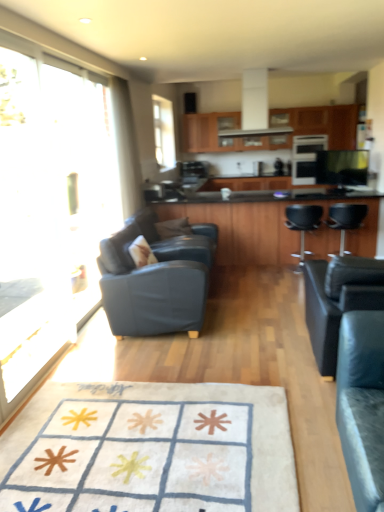
What do you see at coordinates (192, 170) in the screenshot? This screenshot has width=384, height=512. I see `black plastic coffee machine at center` at bounding box center [192, 170].

Where is `black leather chair at right, which is counted as the fourth chair, starting from the left`? black leather chair at right, which is counted as the fourth chair, starting from the left is located at coordinates (346, 219).

Describe the element at coordinates (302, 227) in the screenshot. I see `black leather bar stool at center right, which ranks as the 3th chair in left-to-right order` at that location.

What is the approximate width of black leather bar stool at center right, which ranks as the 3th chair in left-to-right order?

black leather bar stool at center right, which ranks as the 3th chair in left-to-right order, is 21.33 inches wide.

Where is `transparent glass window at upper center`? The image size is (384, 512). transparent glass window at upper center is located at coordinates (158, 132).

What do you see at coordinates (342, 167) in the screenshot? I see `black glossy tv at upper right, which is counted as the 1th appliance, starting from the front` at bounding box center [342, 167].

In order to face black glossy tv at upper right, the 2th appliance in the top-to-bottom sequence, should I rotate leftwards or rightwards?

To face it directly, rotate right by 18.909 degrees.

Find the location of `satin black microwave at center, which is the 1th appliance in top-to-bottom order`. satin black microwave at center, which is the 1th appliance in top-to-bottom order is located at coordinates (306, 157).

From a real-world perspective, is black laminate countertop at center located higher than black leather chair at right, the 1th chair viewed from the right?

Yes.

Where is `countertop on the left side of black leather chair at right, the 1th chair viewed from the right`? countertop on the left side of black leather chair at right, the 1th chair viewed from the right is located at coordinates (263, 225).

Is black laminate countertop at center positioned with its back to black leather chair at right, which is counted as the fourth chair, starting from the left?

black laminate countertop at center is not turned away from black leather chair at right, which is counted as the fourth chair, starting from the left.

Who is smaller, black laminate countertop at center or black leather chair at right, the 1th chair viewed from the right?

black leather chair at right, the 1th chair viewed from the right, is smaller.

This screenshot has width=384, height=512. In order to click on the 2nd appliance behind the white fabric doormat at center, counting from the anchor's position in this screenshot , I will do `click(306, 157)`.

Is satin black microwave at center, which is the 1th appliance from back to front, behind white fabric doormat at center?

Yes, it is.

How different are the orientations of satin black microwave at center, which is the 1th appliance in top-to-bottom order, and white fabric doormat at center in degrees?

The angle between the facing direction of satin black microwave at center, which is the 1th appliance in top-to-bottom order, and the facing direction of white fabric doormat at center is 0.133 degrees.

Is satin black microwave at center, which is the 1th appliance from back to front, taller than white fabric doormat at center?

Yes.

Is black leather bar stool at center right, which appears as the second chair when viewed from the right, shorter than black glossy tv at upper right, which is the 2th appliance from back to front?

No.

Is black leather bar stool at center right, which ranks as the 3th chair in left-to-right order, located outside black glossy tv at upper right, the 1th appliance ordered from the bottom?

Yes, black leather bar stool at center right, which ranks as the 3th chair in left-to-right order, is located beyond the bounds of black glossy tv at upper right, the 1th appliance ordered from the bottom.

From a real-world perspective, does black leather bar stool at center right, which appears as the second chair when viewed from the right, sit lower than black glossy tv at upper right, which is counted as the 1th appliance, starting from the front?

Yes, from a real-world perspective, black leather bar stool at center right, which appears as the second chair when viewed from the right, is beneath black glossy tv at upper right, which is counted as the 1th appliance, starting from the front.

Looking at this image, is black leather bar stool at center right, which ranks as the 3th chair in left-to-right order, positioned with its back to black glossy tv at upper right, the 2th appliance in the top-to-bottom sequence?

No.

How different are the orientations of black plastic coffee machine at center and satin black microwave at center, which is the second appliance from bottom to top, in degrees?

The facing directions of black plastic coffee machine at center and satin black microwave at center, which is the second appliance from bottom to top, are 10.4 degrees apart.

Looking at this image, which is further, (x=192, y=178) or (x=294, y=170)?

The point (x=294, y=170) is farther from the camera.

Visually, is black plastic coffee machine at center positioned to the left or to the right of satin black microwave at center, which is the 1th appliance from back to front?

Based on their positions, black plastic coffee machine at center is located to the left of satin black microwave at center, which is the 1th appliance from back to front.

In the scene shown: From a real-world perspective, who is located lower, black plastic coffee machine at center or satin black microwave at center, which is the second appliance from bottom to top?

From a 3D spatial view, black plastic coffee machine at center is below.

In the image, is black laminate countertop at center positioned in front of or behind black glossy tv at upper right, which is counted as the 1th appliance, starting from the front?

Visually, black laminate countertop at center is located in front of black glossy tv at upper right, which is counted as the 1th appliance, starting from the front.

Is black laminate countertop at center in contact with black glossy tv at upper right, which is counted as the 1th appliance, starting from the front?

black laminate countertop at center and black glossy tv at upper right, which is counted as the 1th appliance, starting from the front, are clearly separated.

Could you tell me if black laminate countertop at center is turned towards black glossy tv at upper right, which is counted as the 1th appliance, starting from the front?

No.

From the image's perspective, is black laminate countertop at center beneath black glossy tv at upper right, which is the 2th appliance from back to front?

Yes.

Is white fabric doormat at center bigger or smaller than transparent glass door at left?

In the image, white fabric doormat at center appears to be smaller than transparent glass door at left.

Is white fabric doormat at center far away from transparent glass door at left?

Absolutely, white fabric doormat at center is distant from transparent glass door at left.

Is white fabric doormat at center turned away from transparent glass door at left?

No, white fabric doormat at center is not facing the opposite direction of transparent glass door at left.

Based on the photo, can you confirm if white fabric doormat at center is taller than transparent glass door at left?

No.

Is white glossy exhaust hood at upper center facing towards white fabric doormat at center?

No, white glossy exhaust hood at upper center is not aimed at white fabric doormat at center.

Is point (242, 108) more distant than point (219, 459)?

Yes, point (242, 108) is farther from viewer.

Considering the relative positions of white glossy exhaust hood at upper center and white fabric doormat at center in the image provided, is white glossy exhaust hood at upper center to the right of white fabric doormat at center from the viewer's perspective?

Correct, you'll find white glossy exhaust hood at upper center to the right of white fabric doormat at center.

Locate an element on the screen. This screenshot has height=512, width=384. countertop on the left of black leather chair at right, the 1th chair viewed from the right is located at coordinates (263, 225).

This screenshot has width=384, height=512. Identify the location of doormat below the satin black microwave at center, which is the 1th appliance in top-to-bottom order (from the image's perspective). (150, 449).

When comparing their distances from black plastic coffee machine at center, does transparent glass door at left or black leather bar stool at center right, which ranks as the 3th chair in left-to-right order, seem closer?

black leather bar stool at center right, which ranks as the 3th chair in left-to-right order, lies closer to black plastic coffee machine at center than the other object.

From the image, which object appears to be farther from satin black microwave at center, which is the 1th appliance in top-to-bottom order, black leather chair at right, the 1th chair viewed from the right, or black leather bar stool at center right, which appears as the second chair when viewed from the right?

black leather chair at right, the 1th chair viewed from the right.

Looking at the image, which one is located closer to white fabric doormat at center, satin black microwave at center, placed as the second appliance when sorted from front to back, or black leather chair at right, positioned as the 3th chair in right-to-left order?

The object closer to white fabric doormat at center is black leather chair at right, positioned as the 3th chair in right-to-left order.

When comparing their distances from black plastic coffee machine at center, does matte blue leather chair at left, which is the fourth chair in right-to-left order, or transparent glass door at left seem closer?

matte blue leather chair at left, which is the fourth chair in right-to-left order, is positioned closer to the anchor black plastic coffee machine at center.

When comparing their distances from black leather chair at right, the 1th chair viewed from the right, does black laminate countertop at center or black leather bar stool at center right, which ranks as the 3th chair in left-to-right order, seem closer?

Based on the image, black leather bar stool at center right, which ranks as the 3th chair in left-to-right order, appears to be nearer to black leather chair at right, the 1th chair viewed from the right.

Considering their positions, is black plastic coffee machine at center positioned further to matte blue leather chair at left, which is the fourth chair in right-to-left order, than wooden cabinets at upper center?

wooden cabinets at upper center.

Estimate the real-world distances between objects in this image. Which object is further from satin black microwave at center, placed as the second appliance when sorted from front to back, black leather chair at right, which is counted as the fourth chair, starting from the left, or wooden cabinets at upper center?

wooden cabinets at upper center is positioned further to the anchor satin black microwave at center, placed as the second appliance when sorted from front to back.

Considering their positions, is white fabric doormat at center positioned closer to transparent glass door at left than black laminate countertop at center?

The object closer to transparent glass door at left is white fabric doormat at center.

Locate an element on the screen. This screenshot has height=512, width=384. cabinetry positioned between black leather chair at right, the 1th chair viewed from the right, and black plastic coffee machine at center from near to far is located at coordinates [210, 131].

Where is `window between white fabric doormat at center and wooden cabinets at upper center from front to back`? The height and width of the screenshot is (512, 384). window between white fabric doormat at center and wooden cabinets at upper center from front to back is located at coordinates (158, 132).

Where is `countertop between black leather chair at right, which is the 2th chair from left to right, and wooden cabinets at upper center, along the z-axis`? The height and width of the screenshot is (512, 384). countertop between black leather chair at right, which is the 2th chair from left to right, and wooden cabinets at upper center, along the z-axis is located at coordinates (263, 225).

Locate an element on the screen. The height and width of the screenshot is (512, 384). countertop between transparent glass door at left and black glossy tv at upper right, the 2th appliance in the top-to-bottom sequence, along the z-axis is located at coordinates (263, 225).